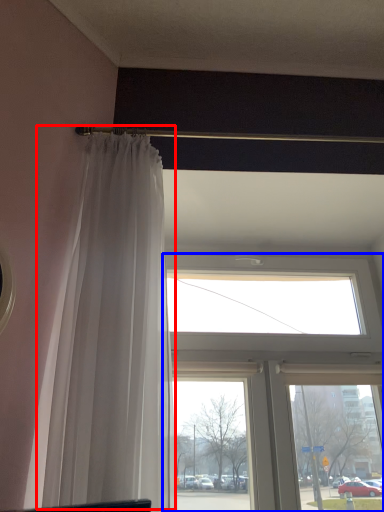
Question: Among these objects, which one is farthest to the camera, curtain (highlighted by a red box) or window (highlighted by a blue box)?

Choices:
 (A) curtain
 (B) window

Answer: (B)